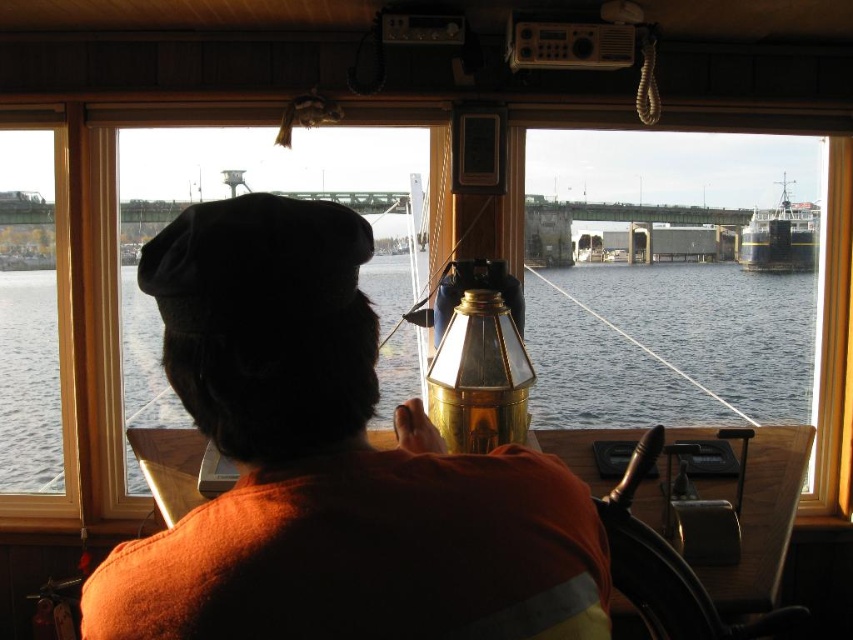
Between point (399, 636) and point (780, 236), which one is positioned in front?

Point (399, 636) is in front.

Does point (283, 390) come closer to viewer compared to point (772, 232)?

Yes, point (283, 390) is closer to viewer.

Locate an element on the screen. This screenshot has height=640, width=853. orange fabric shirt at center is located at coordinates (329, 465).

Based on the photo, is clear water at center above dark blue metallic boat at upper right?

Actually, clear water at center is below dark blue metallic boat at upper right.

Can you confirm if clear water at center is bigger than dark blue metallic boat at upper right?

Yes, clear water at center is bigger than dark blue metallic boat at upper right.

What do you see at coordinates (670, 346) in the screenshot?
I see `clear water at center` at bounding box center [670, 346].

You are a GUI agent. You are given a task and a screenshot of the screen. Output one action in this format:
    pyautogui.click(x=<x>, y=<y>)
    Task: Click on the clear water at center
    Image resolution: width=853 pixels, height=640 pixels.
    Given the screenshot: What is the action you would take?
    pyautogui.click(x=670, y=346)

Which is below, orange fabric shirt at center or transparent glass window at center?

orange fabric shirt at center is below.

You are a GUI agent. You are given a task and a screenshot of the screen. Output one action in this format:
    pyautogui.click(x=<x>, y=<y>)
    Task: Click on the orange fabric shirt at center
    
    Given the screenshot: What is the action you would take?
    pyautogui.click(x=329, y=465)